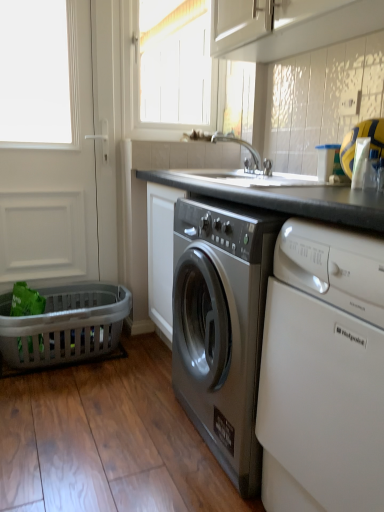
Describe the element at coordinates (175, 62) in the screenshot. Image resolution: width=384 pixels, height=512 pixels. I see `white wood window at upper center` at that location.

What do you see at coordinates (53, 187) in the screenshot? This screenshot has height=512, width=384. I see `white matte screen door at left` at bounding box center [53, 187].

Identify the location of black granite countertop at center. This screenshot has width=384, height=512. (282, 351).

The height and width of the screenshot is (512, 384). Describe the element at coordinates (323, 372) in the screenshot. I see `white glossy dishwasher at right` at that location.

The image size is (384, 512). What do you see at coordinates (322, 99) in the screenshot?
I see `white glossy cabinet at upper center` at bounding box center [322, 99].

Where is `white wood window at upper center`? This screenshot has width=384, height=512. white wood window at upper center is located at coordinates (175, 62).

Does white matte screen door at left have a smaller size compared to white glossy cabinet at upper center?

No, white matte screen door at left is not smaller than white glossy cabinet at upper center.

Is white matte screen door at left oriented away from white glossy cabinet at upper center?

No, white matte screen door at left is not facing away from white glossy cabinet at upper center.

Is the surface of white matte screen door at left in direct contact with white glossy cabinet at upper center?

white matte screen door at left and white glossy cabinet at upper center are not in contact.

Consider the image. Between white matte screen door at left and white glossy cabinet at upper center, which one has more height?

white matte screen door at left is taller.

Is white glossy dishwasher at right located outside white glossy cabinet at upper center?

Yes, white glossy dishwasher at right is outside of white glossy cabinet at upper center.

Is white glossy dishwasher at right taller or shorter than white glossy cabinet at upper center?

Considering their sizes, white glossy dishwasher at right has more height than white glossy cabinet at upper center.

You are a GUI agent. You are given a task and a screenshot of the screen. Output one action in this format:
    pyautogui.click(x=<x>, y=<y>)
    Task: Click on the washing machine in front of the white glossy cabinet at upper center
    
    Given the screenshot: What is the action you would take?
    pyautogui.click(x=323, y=372)

Relative to white glossy cabinet at upper center, is white glossy dishwasher at right in front or behind?

Visually, white glossy dishwasher at right is located in front of white glossy cabinet at upper center.

Can we say white matte screen door at left lies outside white glossy dishwasher at right?

Yes, white matte screen door at left is outside of white glossy dishwasher at right.

Is white matte screen door at left directly adjacent to white glossy dishwasher at right?

No, white matte screen door at left is not making contact with white glossy dishwasher at right.

From the image's perspective, which is below, white matte screen door at left or white glossy dishwasher at right?

white glossy dishwasher at right.

From the picture: Can you confirm if white matte screen door at left is shorter than white glossy dishwasher at right?

Incorrect, the height of white matte screen door at left does not fall short of that of white glossy dishwasher at right.

Can you confirm if black granite countertop at center is positioned to the right of white glossy cabinet at upper center?

No, black granite countertop at center is not to the right of white glossy cabinet at upper center.

Is black granite countertop at center far from white glossy cabinet at upper center?

No, black granite countertop at center is not far away from white glossy cabinet at upper center.

From the image's perspective, relative to white glossy cabinet at upper center, is black granite countertop at center above or below?

Based on their image positions, black granite countertop at center is located beneath white glossy cabinet at upper center.

Based on the photo, can we say gray plastic laundry basket at lower left lies outside white glossy cabinet at upper center?

Absolutely, gray plastic laundry basket at lower left is external to white glossy cabinet at upper center.

Is gray plastic laundry basket at lower left in contact with white glossy cabinet at upper center?

gray plastic laundry basket at lower left and white glossy cabinet at upper center are clearly separated.

Is gray plastic laundry basket at lower left bigger or smaller than white glossy cabinet at upper center?

Considering their sizes, gray plastic laundry basket at lower left takes up more space than white glossy cabinet at upper center.

Could you tell me if gray plastic laundry basket at lower left is turned towards white glossy cabinet at upper center?

No, gray plastic laundry basket at lower left is not facing towards white glossy cabinet at upper center.

Is white glossy dishwasher at right situated inside black granite countertop at center or outside?

white glossy dishwasher at right cannot be found inside black granite countertop at center.

Based on the photo, does white glossy dishwasher at right appear on the left side of black granite countertop at center?

In fact, white glossy dishwasher at right is to the right of black granite countertop at center.

You are a GUI agent. You are given a task and a screenshot of the screen. Output one action in this format:
    pyautogui.click(x=<x>, y=<y>)
    Task: Click on the washing machine that is in front of the black granite countertop at center
    Image resolution: width=384 pixels, height=512 pixels.
    Given the screenshot: What is the action you would take?
    pyautogui.click(x=323, y=372)

Is black granite countertop at center at the back of white glossy dishwasher at right?

No, white glossy dishwasher at right is not facing the opposite direction of black granite countertop at center.

Considering the points (355, 337) and (95, 306), which point is behind, point (355, 337) or point (95, 306)?

The point (95, 306) is farther.

How different are the orientations of black granite countertop at center and gray plastic laundry basket at lower left in degrees?

There is a 87.4-degree angle between the facing directions of black granite countertop at center and gray plastic laundry basket at lower left.

Between black granite countertop at center and gray plastic laundry basket at lower left, which one has larger width?

black granite countertop at center is wider.

This screenshot has height=512, width=384. In order to click on basket below the black granite countertop at center (from the image's perspective) in this screenshot , I will do `click(65, 325)`.

You are a GUI agent. You are given a task and a screenshot of the screen. Output one action in this format:
    pyautogui.click(x=<x>, y=<y>)
    Task: Click on the cabinetry above the white matte screen door at left (from a real-world perspective)
    The image size is (384, 512).
    Given the screenshot: What is the action you would take?
    pyautogui.click(x=322, y=99)

Find the location of a particular element. Image resolution: width=384 pixels, height=512 pixels. washing machine that is below the white glossy cabinet at upper center (from the image's perspective) is located at coordinates (323, 372).

Based on their spatial positions, is white matte screen door at left or white glossy dishwasher at right further from white glossy cabinet at upper center?

The object further to white glossy cabinet at upper center is white matte screen door at left.

Estimate the real-world distances between objects in this image. Which object is further from white wood window at upper center, white glossy cabinet at upper center or black granite countertop at center?

black granite countertop at center is positioned further to the anchor white wood window at upper center.

From the image, which object appears to be farther from white glossy dishwasher at right, white wood window at upper center or gray plastic laundry basket at lower left?

white wood window at upper center.

From the image, which object appears to be nearer to white matte screen door at left, gray plastic laundry basket at lower left or white glossy cabinet at upper center?

Among the two, gray plastic laundry basket at lower left is located nearer to white matte screen door at left.

Which object lies nearer to the anchor point white glossy dishwasher at right, white wood window at upper center or white glossy cabinet at upper center?

white glossy cabinet at upper center is positioned closer to the anchor white glossy dishwasher at right.

In the scene shown: When comparing their distances from black granite countertop at center, does white glossy cabinet at upper center or white matte screen door at left seem further?

white matte screen door at left is further to black granite countertop at center.

Estimate the real-world distances between objects in this image. Which object is further from white matte screen door at left, white glossy cabinet at upper center or white wood window at upper center?

Based on the image, white wood window at upper center appears to be further to white matte screen door at left.

Looking at the image, which one is located closer to white glossy dishwasher at right, white glossy cabinet at upper center or white matte screen door at left?

white glossy cabinet at upper center is positioned closer to the anchor white glossy dishwasher at right.

At what (x,y) coordinates should I click in order to perform the action: click on counter between gray plastic laundry basket at lower left and white glossy dishwasher at right. Please return your answer as a coordinate pair (x, y). Looking at the image, I should click on (282, 351).

Locate an element on the screen. The width and height of the screenshot is (384, 512). cabinetry between white wood window at upper center and black granite countertop at center in the up-down direction is located at coordinates (322, 99).

At what (x,y) coordinates should I click in order to perform the action: click on counter between white matte screen door at left and white glossy cabinet at upper center in the horizontal direction. Please return your answer as a coordinate pair (x, y). Image resolution: width=384 pixels, height=512 pixels. Looking at the image, I should click on (282, 351).

Locate an element on the screen. The height and width of the screenshot is (512, 384). cabinetry between white matte screen door at left and white glossy dishwasher at right is located at coordinates (322, 99).